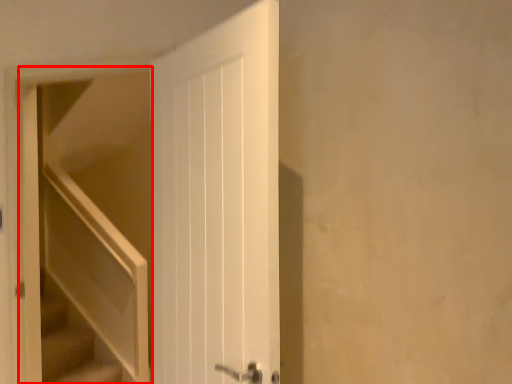
Question: From the image's perspective, where is elevator (annotated by the red box) located in relation to stairs in the image?

Choices:
 (A) above
 (B) below

Answer: (A)